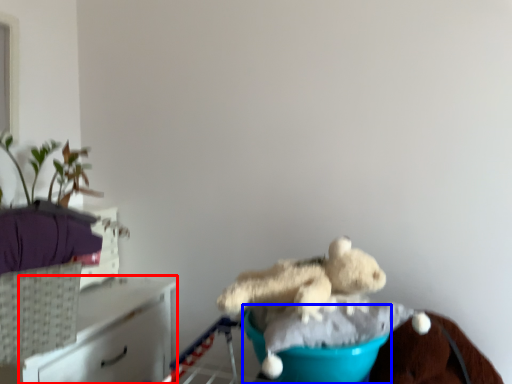
Question: Which object is further to the camera taking this photo, furniture (highlighted by a red box) or teal (highlighted by a blue box)?

Choices:
 (A) furniture
 (B) teal

Answer: (A)